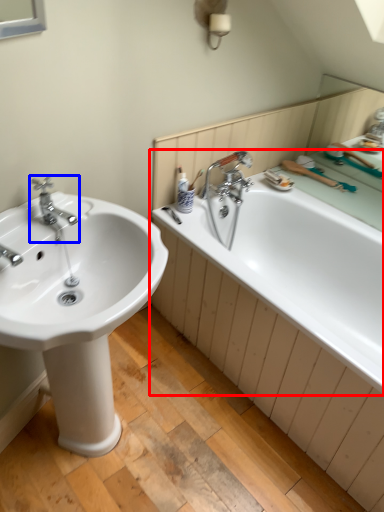
Question: Which of the following is the closest to the observer, bathtub (highlighted by a red box) or tap (highlighted by a blue box)?

Choices:
 (A) bathtub
 (B) tap

Answer: (A)